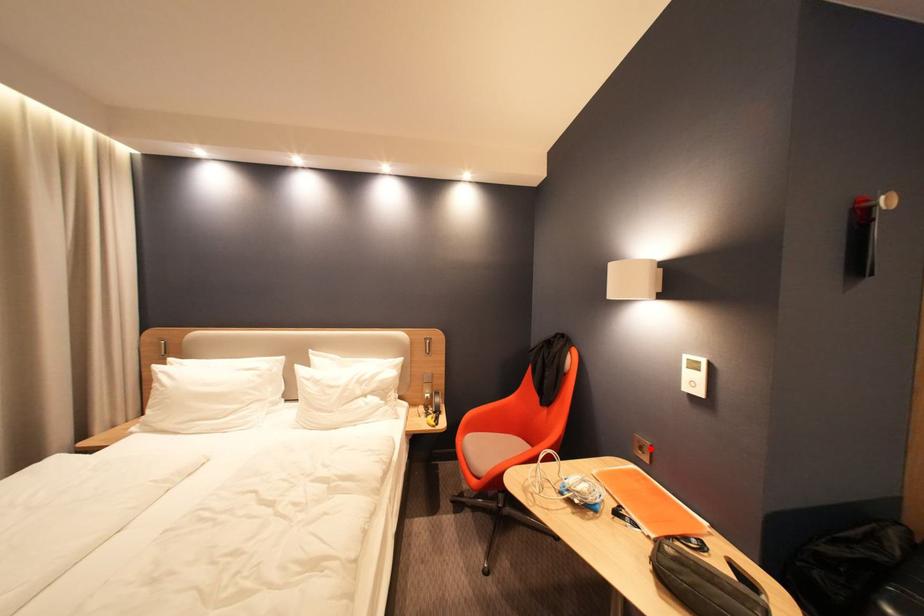
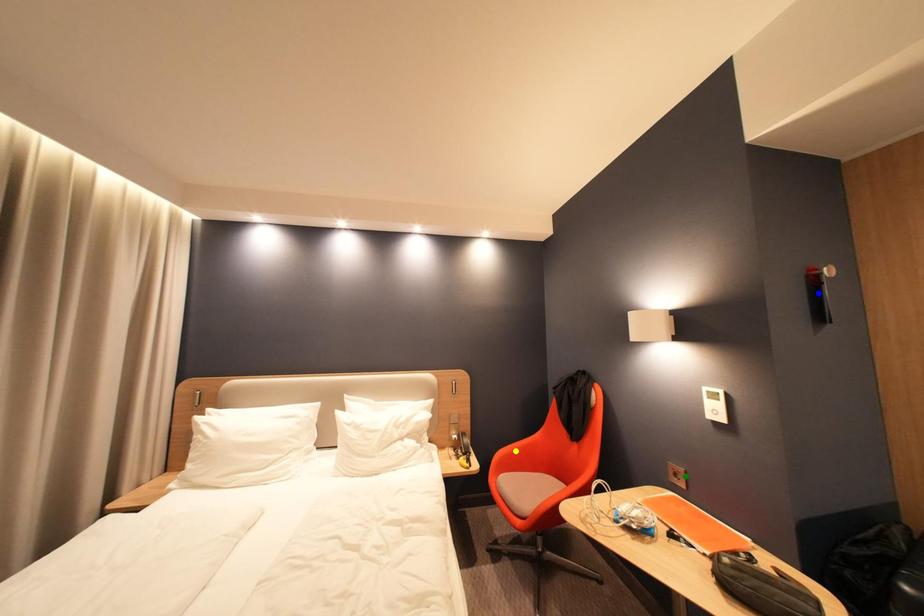
Question: I am providing you with two images of the same scene from different viewpoints. A red point is marked on the first image. You are given multiple points on the second image. Which point in image 2 is actually the same real-world point as the red point in image 1?

Choices:
 (A) blue point
 (B) green point
 (C) yellow point

Answer: (B)